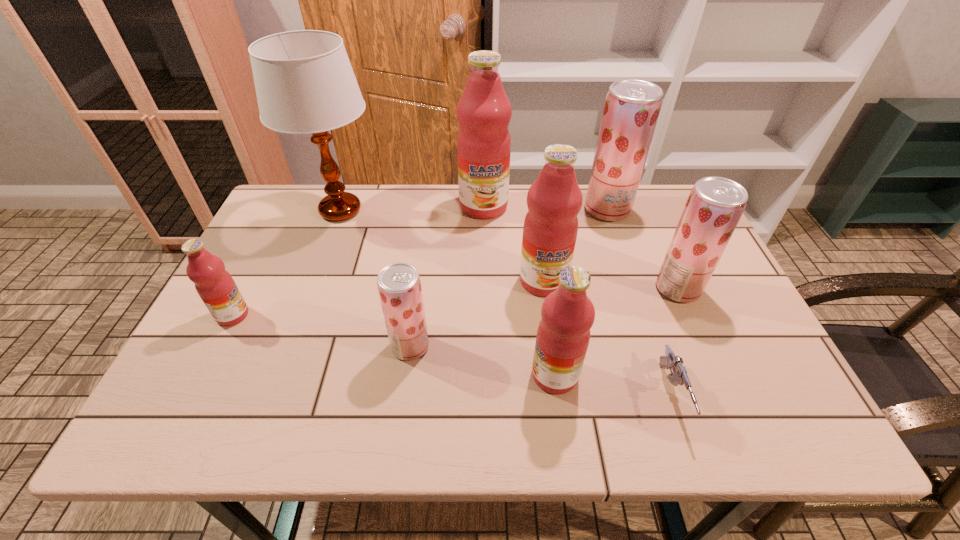
At what (x,y) coordinates should I click in order to perform the action: click on vacant space located 0.270m on the label of the leftmost fruit juice. Please return your answer as a coordinate pair (x, y). Looking at the image, I should click on (360, 315).

Locate an element on the screen. This screenshot has height=540, width=960. free space located 0.320m on the back of the nearest strawberry fruit juice is located at coordinates (424, 242).

Image resolution: width=960 pixels, height=540 pixels. I want to click on table lamp that is at the far edge, so click(304, 81).

At what (x,y) coordinates should I click in order to perform the action: click on object situated at the near edge. Please return your answer as a coordinate pair (x, y). Looking at the image, I should click on (679, 376).

Identify the location of table lamp at the left edge. Image resolution: width=960 pixels, height=540 pixels. 304,81.

The width and height of the screenshot is (960, 540). I want to click on fruit juice located at the left edge, so click(x=215, y=286).

At what (x,y) coordinates should I click in order to perform the action: click on object that is at the right edge. Please return your answer as a coordinate pair (x, y). Looking at the image, I should click on (715, 205).

At what (x,y) coordinates should I click in order to perform the action: click on object that is at the far left corner. Please return your answer as a coordinate pair (x, y). This screenshot has width=960, height=540. Looking at the image, I should click on (304, 81).

The image size is (960, 540). I want to click on vacant space at the far edge of the desktop, so click(507, 210).

In order to click on vacant space at the left edge of the desktop in this screenshot , I will do pos(300,264).